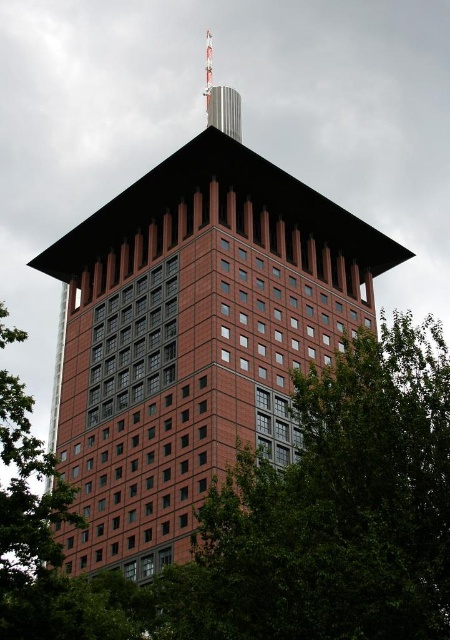
You are standing at the entrance of the building and want to locate the green leafy tree at center. According to the coordinates provided, in which direction should you look to find it?

The green leafy tree at center is located at coordinates point (333, 509), so you should look towards the upper right direction to find it.

You are a city planner reviewing this architectural design. You notice two green leafy trees in the image. Which tree, the green leafy tree at center or the green leafy tree at lower left, is taller?

The green leafy tree at lower left is taller than the green leafy tree at center.

You are a landscape architect designing a garden around the building. You need to place a new bench that requires at least 2 meters of space between it and any tree. If you want to place the bench between the green leafy tree at center and the green leafy tree at lower left, can you do so based on their widths?

The green leafy tree at center might be wider than green leafy tree at lower left, so the required 2 meters of space between the bench and both trees may not be achievable if the combined widths of the trees exceed the available space between them. Further measurements would be needed to confirm.